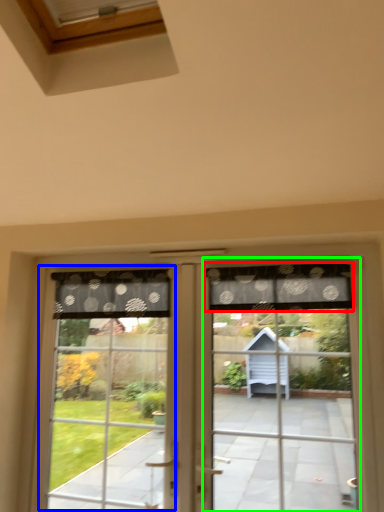
Question: Based on their relative distances, which object is farther from curtain (highlighted by a red box)? Choose from bay window (highlighted by a blue box) and screen door (highlighted by a green box).

Choices:
 (A) bay window
 (B) screen door

Answer: (A)